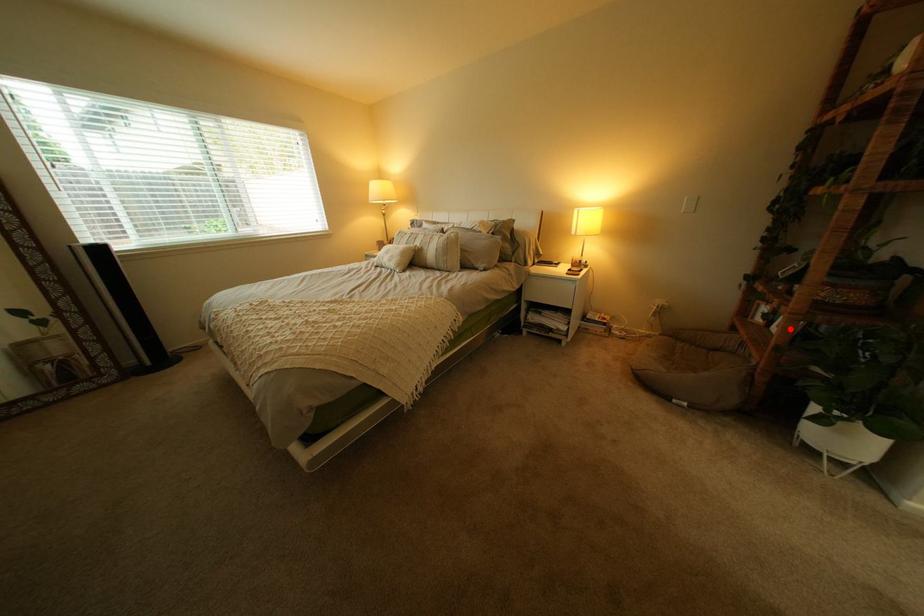
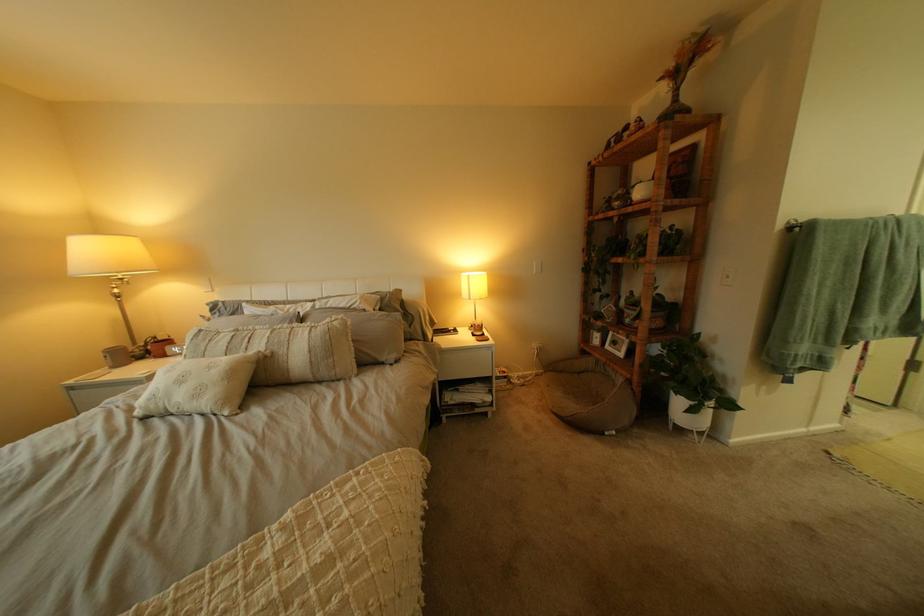
Question: I am providing you with two images of the same scene from different viewpoints. A red point is marked on the first image. At the location where the point appears in image 1, is it still visible in image 2?

Choices:
 (A) Yes
 (B) No

Answer: (A)